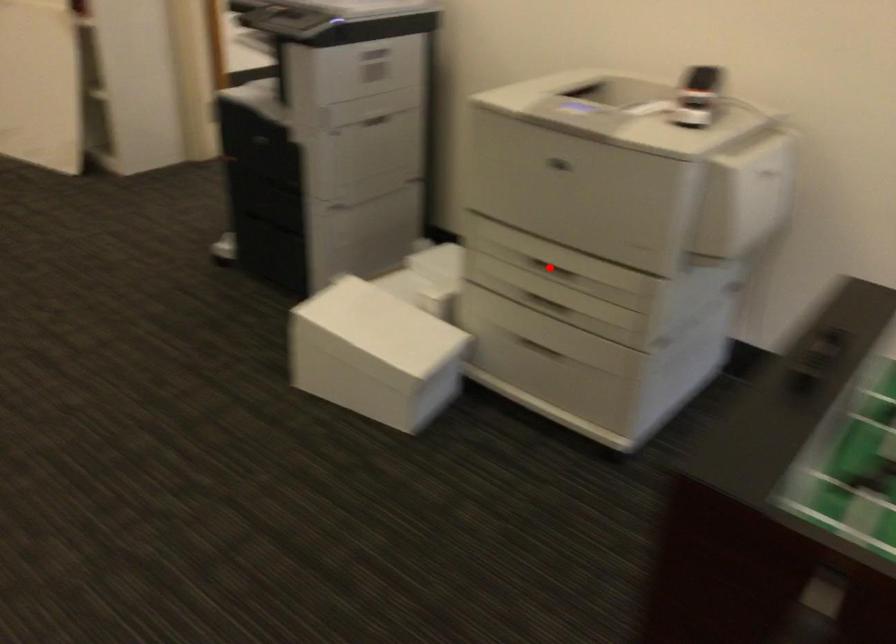
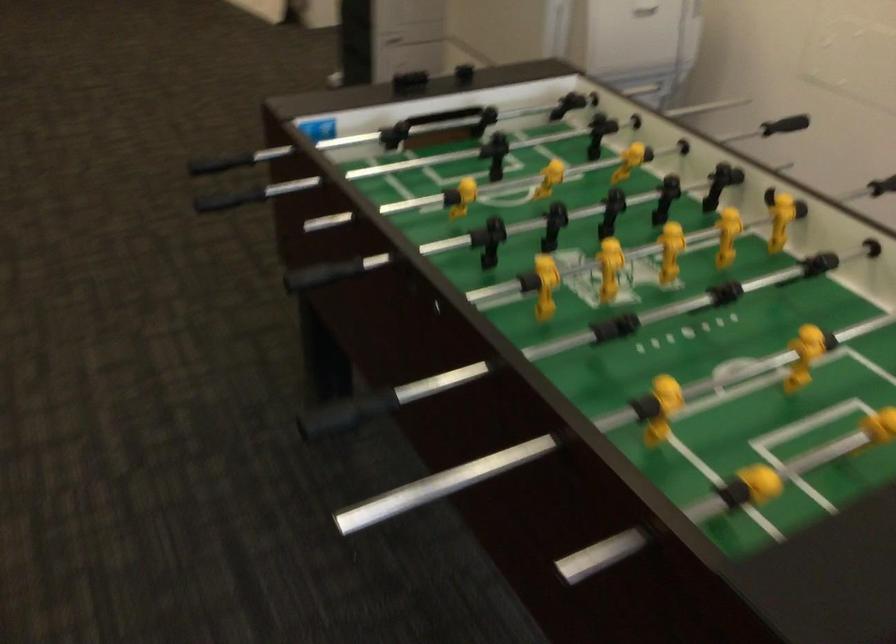
Question: I am providing you with two images of the same scene from different viewpoints. A red point is marked on the first image. Can you still see the location of the red point in image 2?

Choices:
 (A) Yes
 (B) No

Answer: (B)